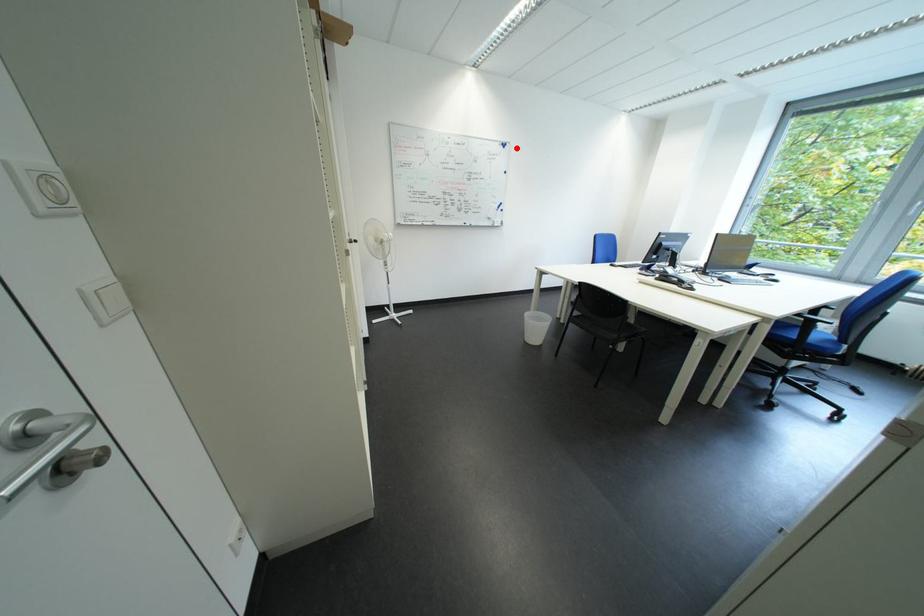
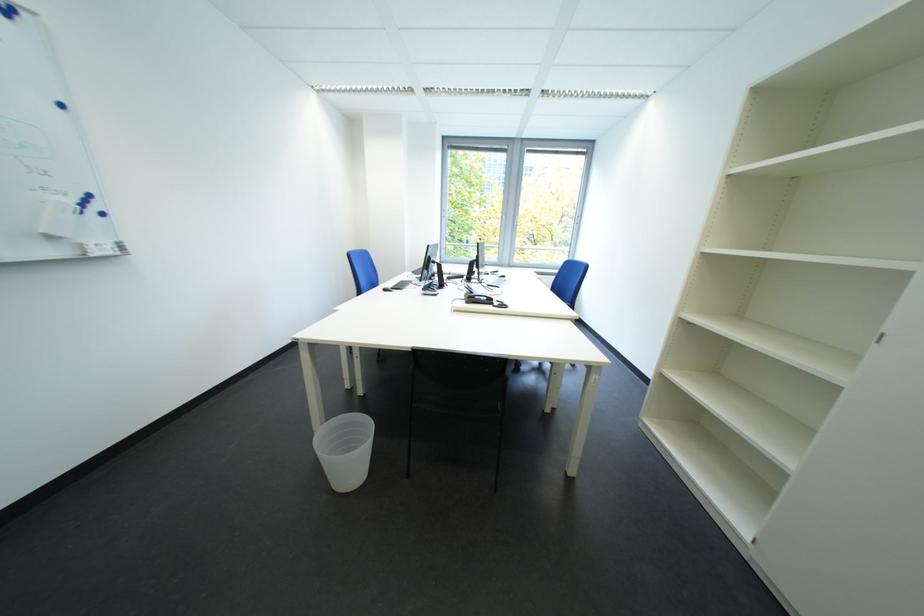
Question: I am providing you with two images of the same scene from different viewpoints. Given a red point in image1, look at the same physical point in image2. Is it:

Choices:
 (A) Closer to the viewpoint
 (B) Farther from the viewpoint

Answer: (B)